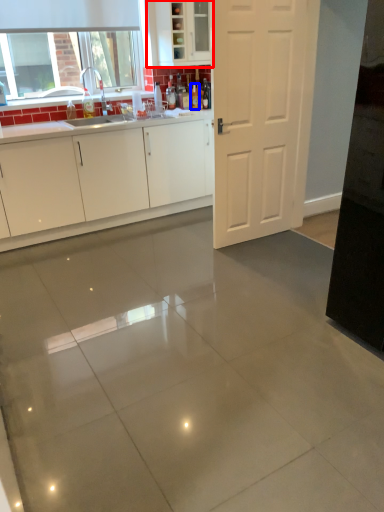
Question: Among these objects, which one is nearest to the camera, cabinetry (highlighted by a red box) or bottle (highlighted by a blue box)?

Choices:
 (A) cabinetry
 (B) bottle

Answer: (A)